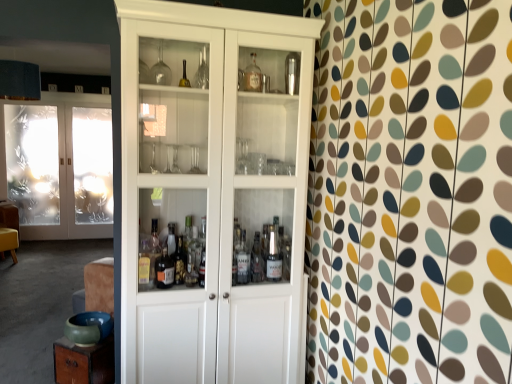
Question: Should I look upward or downward to see transparent plastic screen door at left?

Choices:
 (A) down
 (B) up

Answer: (B)

Question: Is white wood cabinet at center beside transparent plastic screen door at left?

Choices:
 (A) yes
 (B) no

Answer: (B)

Question: Is transparent plastic screen door at left a part of white wood cabinet at center?

Choices:
 (A) yes
 (B) no

Answer: (B)

Question: Is white wood cabinet at center closer to camera compared to transparent plastic screen door at left?

Choices:
 (A) no
 (B) yes

Answer: (B)

Question: Is white wood cabinet at center bigger than transparent plastic screen door at left?

Choices:
 (A) yes
 (B) no

Answer: (A)

Question: Does white wood cabinet at center have a greater height compared to transparent plastic screen door at left?

Choices:
 (A) no
 (B) yes

Answer: (B)

Question: Is white wood cabinet at center wider than transparent plastic screen door at left?

Choices:
 (A) no
 (B) yes

Answer: (B)

Question: Is transparent plastic screen door at left at the back of frosted glass doors at left?

Choices:
 (A) yes
 (B) no

Answer: (B)

Question: Can you confirm if frosted glass doors at left is thinner than transparent plastic screen door at left?

Choices:
 (A) no
 (B) yes

Answer: (A)

Question: Is transparent plastic screen door at left inside frosted glass doors at left?

Choices:
 (A) no
 (B) yes

Answer: (A)

Question: Is frosted glass doors at left far away from transparent plastic screen door at left?

Choices:
 (A) yes
 (B) no

Answer: (B)

Question: Considering the relative sizes of frosted glass doors at left and transparent plastic screen door at left in the image provided, is frosted glass doors at left taller than transparent plastic screen door at left?

Choices:
 (A) no
 (B) yes

Answer: (B)

Question: From the image's perspective, is frosted glass doors at left located above transparent plastic screen door at left?

Choices:
 (A) no
 (B) yes

Answer: (A)

Question: Is transparent plastic screen door at left directly adjacent to frosted glass doors at left?

Choices:
 (A) no
 (B) yes

Answer: (A)